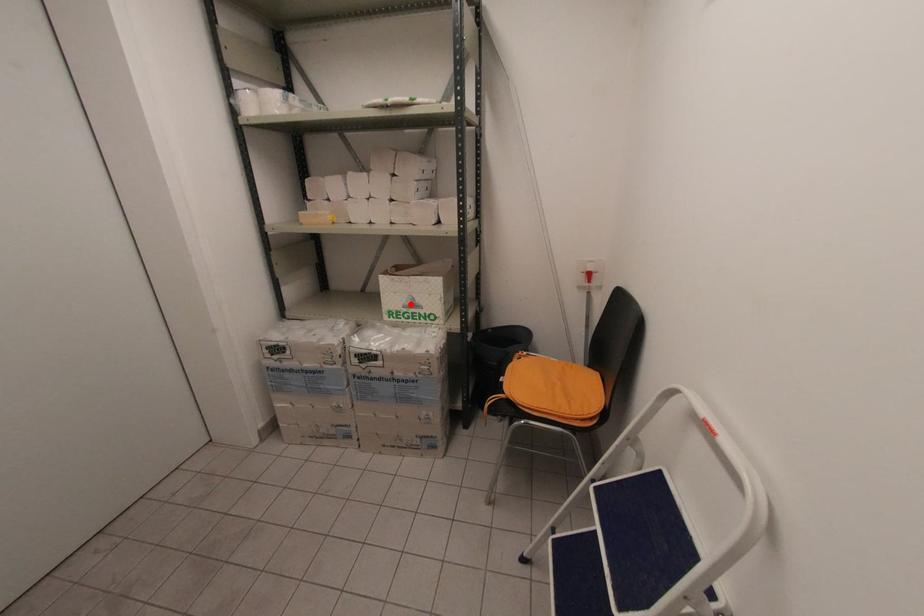
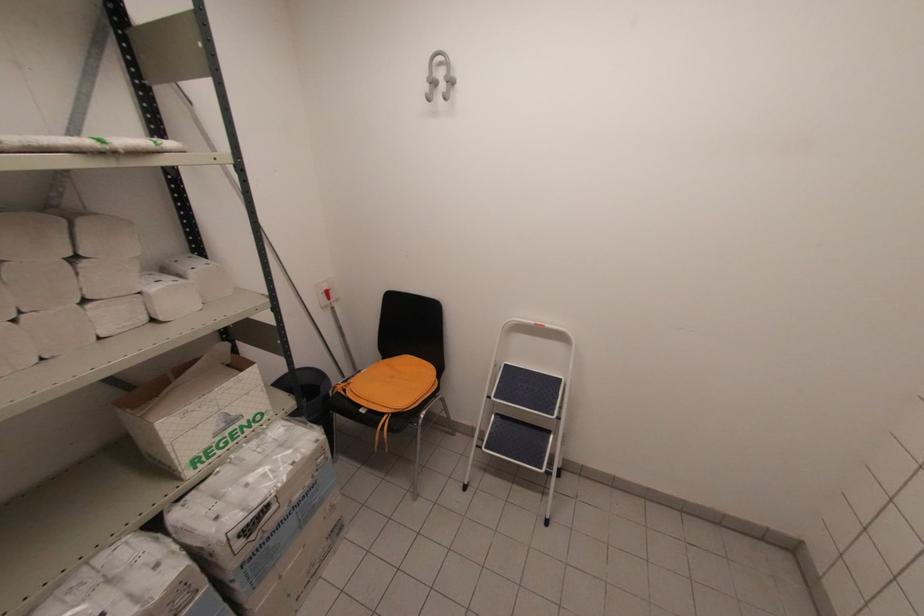
The point at the highlighted location is marked in the first image. Where is the corresponding point in the second image?

(224, 426)